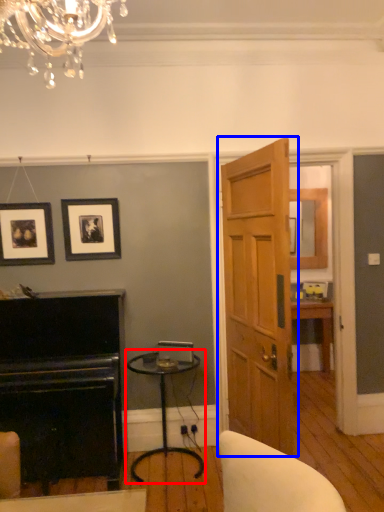
Question: Which point is closer to the camera, table (highlighted by a red box) or door (highlighted by a blue box)?

Choices:
 (A) table
 (B) door

Answer: (B)